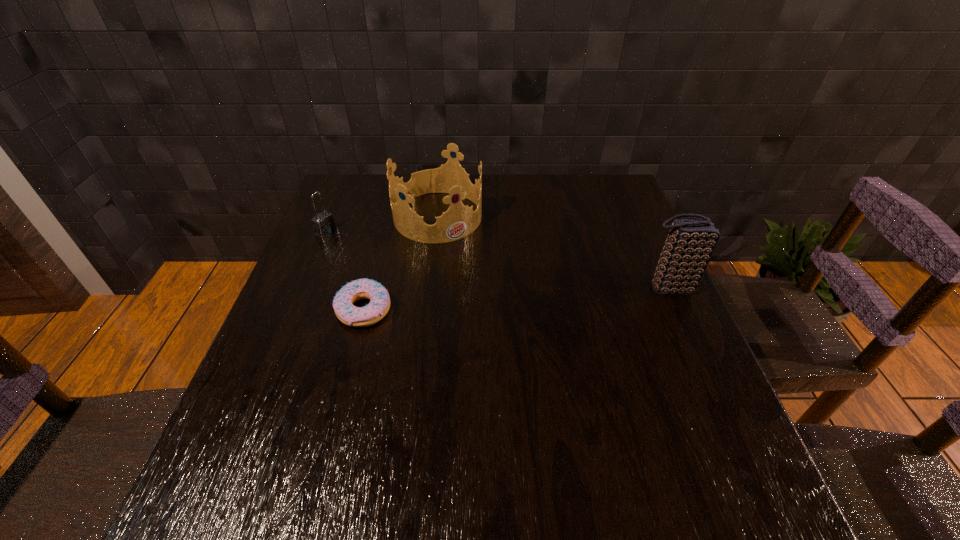
Locate an element on the screen. Image resolution: width=960 pixels, height=540 pixels. vacant space at the far left corner of the desktop is located at coordinates coord(361,186).

Find the location of `free space between the doughnut and the rightmost object`. free space between the doughnut and the rightmost object is located at coordinates (516, 299).

You are a GUI agent. You are given a task and a screenshot of the screen. Output one action in this format:
    pyautogui.click(x=<x>, y=<y>)
    Task: Click on the vacant area that lies between the clutch bag and the shortest object
    This screenshot has width=960, height=540.
    Given the screenshot: What is the action you would take?
    pyautogui.click(x=516, y=299)

Where is `unoccupied position between the leftmost object and the tiara`? unoccupied position between the leftmost object and the tiara is located at coordinates (382, 224).

Find the location of a particular element. Image resolution: width=960 pixels, height=540 pixels. free spot between the shortest object and the clutch bag is located at coordinates point(516,299).

At what (x,y) coordinates should I click in order to perform the action: click on vacant area between the padlock and the shortest object. Please return your answer as a coordinate pair (x, y). The image size is (960, 540). Looking at the image, I should click on (345, 271).

Identify the location of free space between the doughnut and the tallest object. click(x=516, y=299).

At what (x,y) coordinates should I click in order to perform the action: click on vacant space in between the second shortest object and the second tallest object. Please return your answer as a coordinate pair (x, y). Looking at the image, I should click on (382, 224).

Where is `free spot between the padlock and the doughnut`? free spot between the padlock and the doughnut is located at coordinates (345, 271).

Identify the location of free space between the tiara and the shortest object. The width and height of the screenshot is (960, 540). (400, 263).